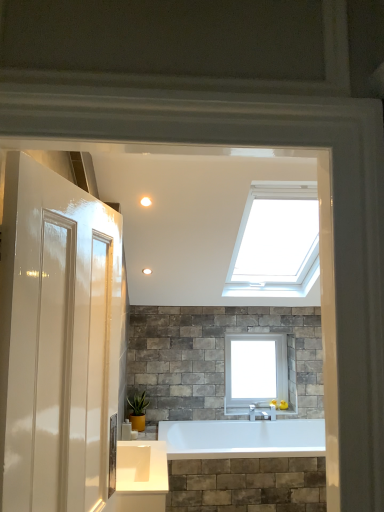
Question: In the image, is matte white light fixture at upper center on the left side or the right side of green matte plant at lower center?

Choices:
 (A) right
 (B) left

Answer: (A)

Question: From a real-world perspective, is matte white light fixture at upper center physically located above or below green matte plant at lower center?

Choices:
 (A) above
 (B) below

Answer: (A)

Question: Which of these objects is positioned closest to the green matte plant at lower center?

Choices:
 (A) white glass window at upper center
 (B) matte white light fixture at upper center

Answer: (A)

Question: Considering the real-world distances, which object is closest to the green matte plant at lower center?

Choices:
 (A) matte white light fixture at upper center
 (B) white glass window at upper center

Answer: (B)